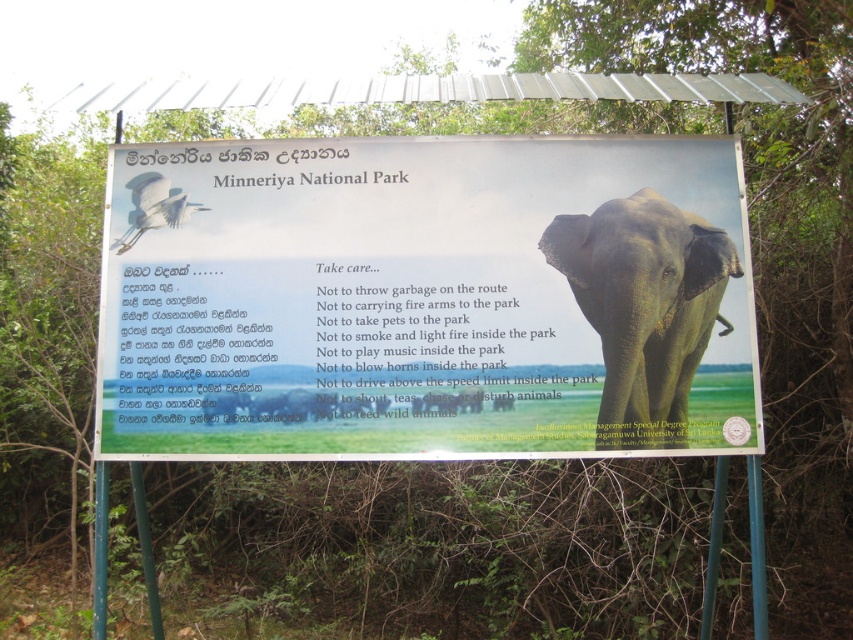
Which is above, matte white signboard at center or white glossy bird at upper left?

white glossy bird at upper left

Who is more distant from viewer, (126,376) or (148,172)?

Point (148,172)

The width and height of the screenshot is (853, 640). In order to click on matte white signboard at center in this screenshot , I will do `click(430, 300)`.

Does gray matte elephant at center appear under white glossy bird at upper left?

Correct, gray matte elephant at center is located below white glossy bird at upper left.

Describe the element at coordinates (643, 307) in the screenshot. I see `gray matte elephant at center` at that location.

Is point (634, 234) positioned in front of point (152, 182)?

Yes, it is in front of point (152, 182).

Image resolution: width=853 pixels, height=640 pixels. Find the location of `gray matte elephant at center`. gray matte elephant at center is located at coordinates (643, 307).

Does matte white signboard at center have a greater height compared to gray matte elephant at center?

Yes.

In the scene shown: Who is positioned more to the left, matte white signboard at center or gray matte elephant at center?

Positioned to the left is matte white signboard at center.

In order to click on matte white signboard at center in this screenshot , I will do `click(430, 300)`.

Where is `matte white signboard at center`? matte white signboard at center is located at coordinates (430, 300).